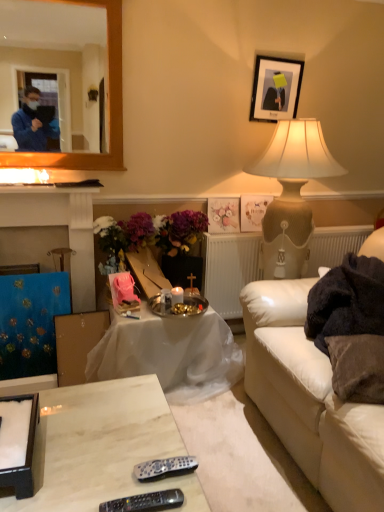
Locate an element on the screen. Image resolution: width=384 pixels, height=512 pixels. free space to the left of black plastic remote at lower center, the 1th remote viewed from the front is located at coordinates (87, 489).